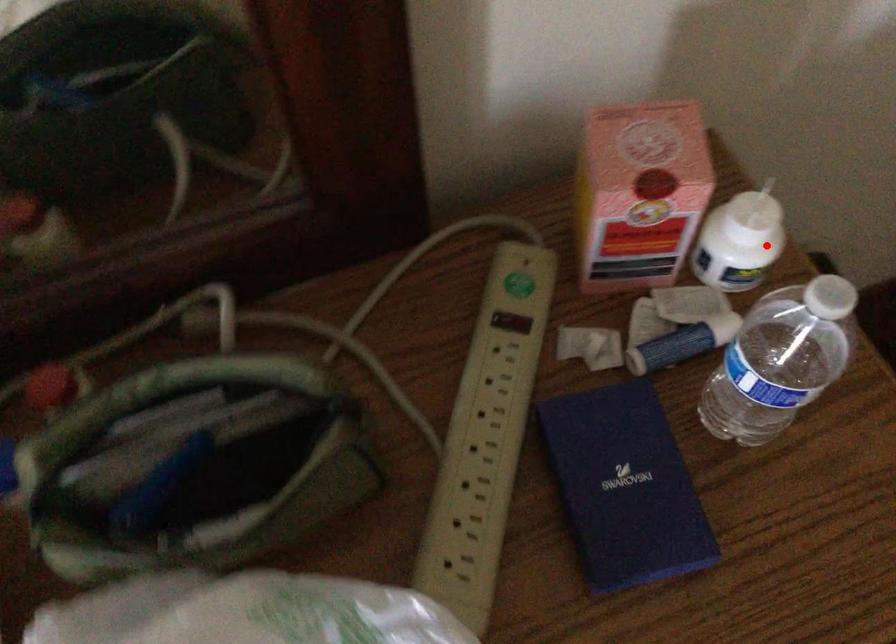
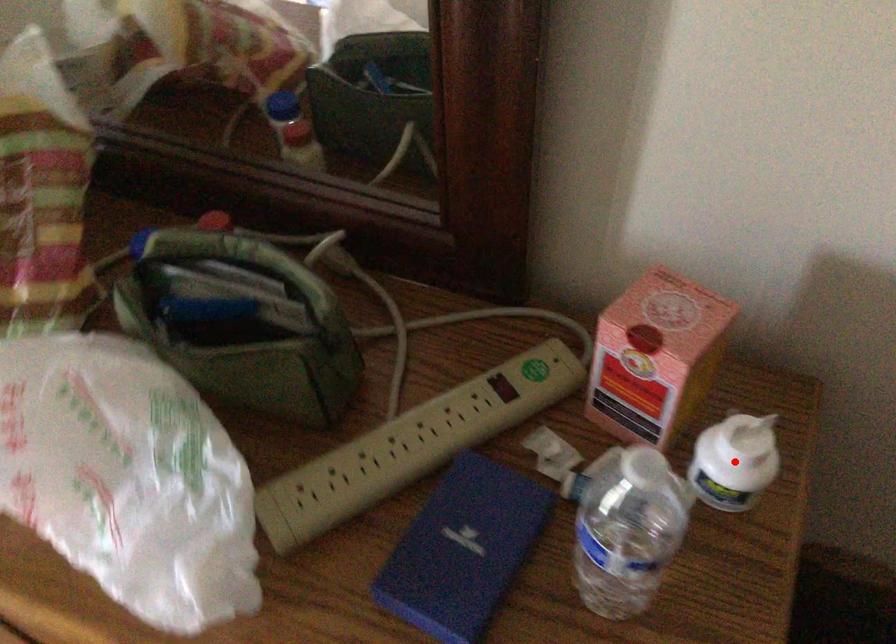
I am providing you with two images of the same scene from different viewpoints. A red point is marked on the first image and another point is marked on the second image. Are the points marked in image1 and image2 representing the same 3D position?

Yes